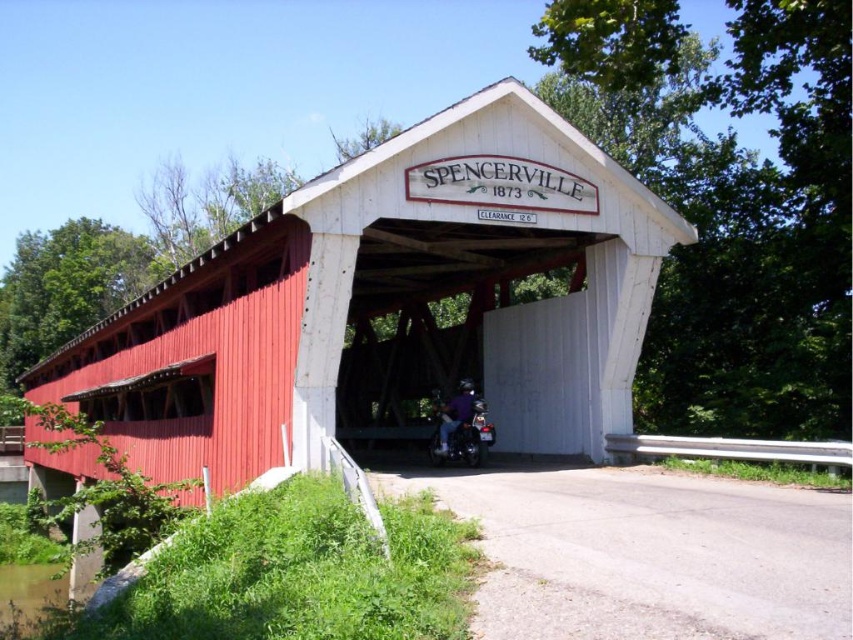
You are standing at the entrance of the Spencerville bridge and want to walk towards the point labeled as point (462,413). As you move forward, will the point labeled point (570,291) become visible or hidden from your view?

Since point (570,291) is behind point (462,413), moving towards point (462,413) would mean that point (570,291) would be hidden from view as it is obscured by the closer point.